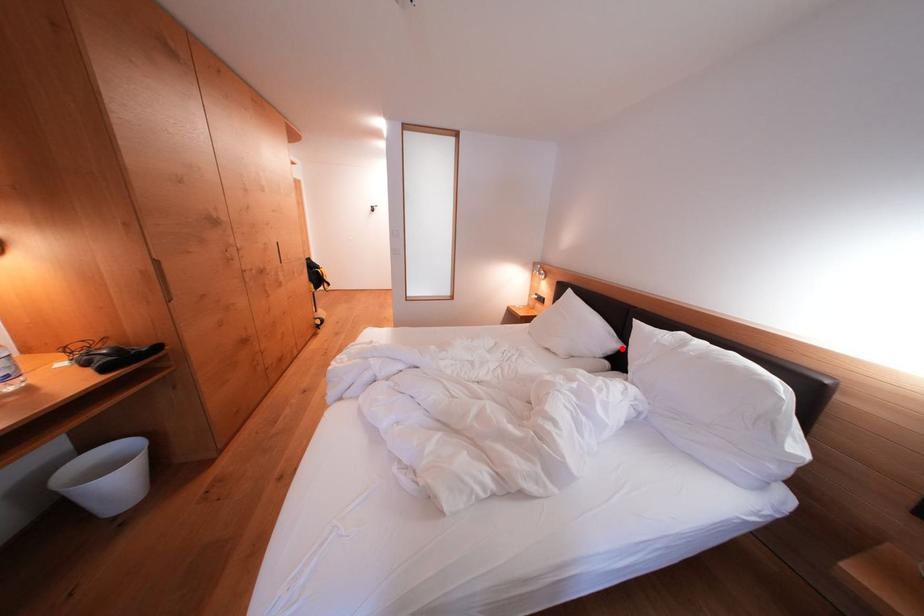
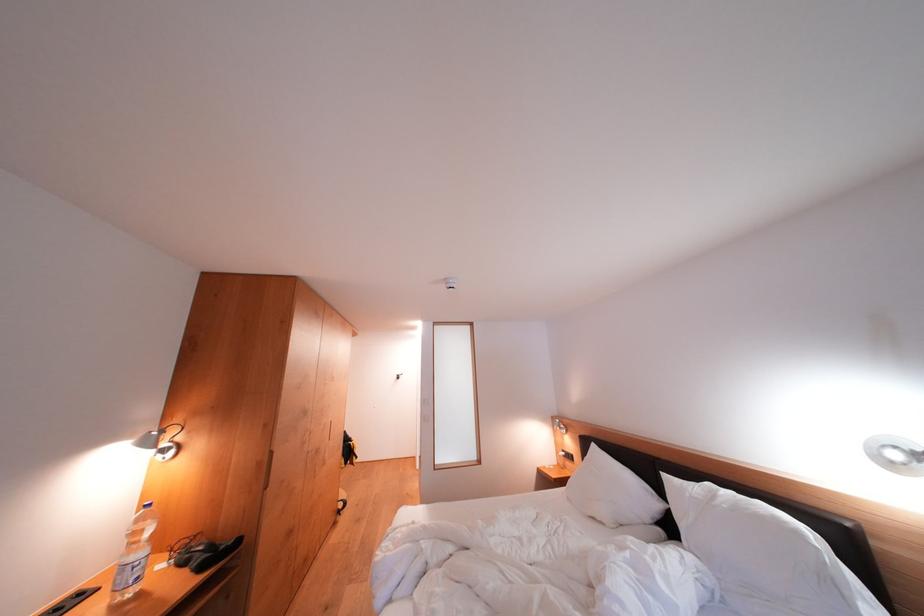
Where in the second image is the point corresponding to the highlighted location from the first image?

(664, 509)